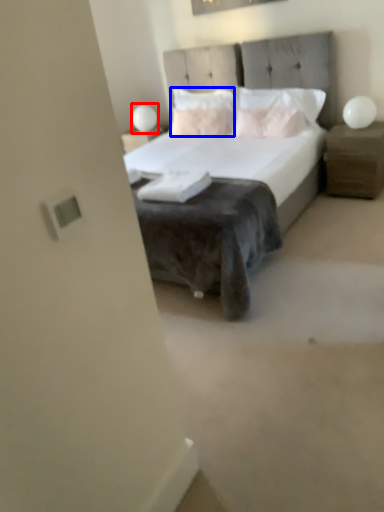
Question: Which object is further to the camera taking this photo, table lamp (highlighted by a red box) or pillow (highlighted by a blue box)?

Choices:
 (A) table lamp
 (B) pillow

Answer: (A)